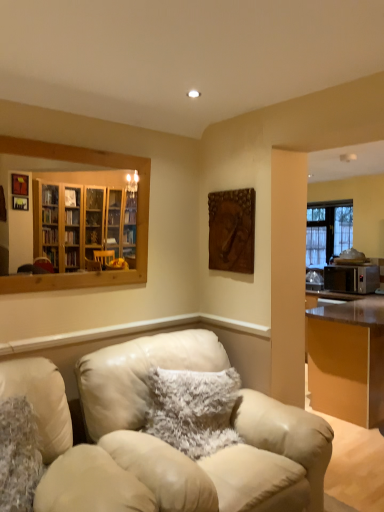
At what (x,y) coordinates should I click in order to perform the action: click on vacant space situated above wooden frame mirror at upper left (from a real-world perspective). Please return your answer as a coordinate pair (x, y). Looking at the image, I should click on (77, 144).